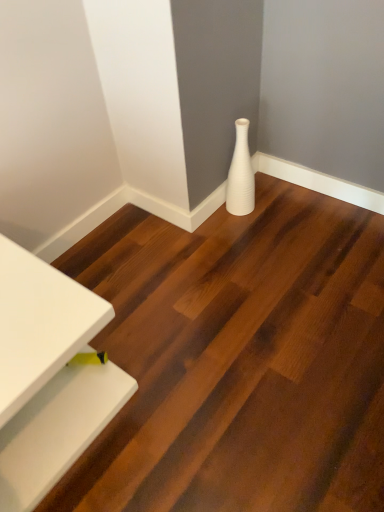
Question: From the image's perspective, would you say white ribbed vase at lower right is positioned over white glossy vase at center?

Choices:
 (A) no
 (B) yes

Answer: (B)

Question: Would you say white glossy vase at center is part of white ribbed vase at lower right's contents?

Choices:
 (A) yes
 (B) no

Answer: (B)

Question: Is white ribbed vase at lower right further to the viewer compared to white glossy vase at center?

Choices:
 (A) no
 (B) yes

Answer: (B)

Question: Does white ribbed vase at lower right appear on the right side of white glossy vase at center?

Choices:
 (A) yes
 (B) no

Answer: (A)

Question: Is white ribbed vase at lower right smaller than white glossy vase at center?

Choices:
 (A) yes
 (B) no

Answer: (A)

Question: Can you confirm if white ribbed vase at lower right is taller than white glossy vase at center?

Choices:
 (A) no
 (B) yes

Answer: (B)

Question: Can you confirm if white ribbed vase at lower right is smaller than white glossy table at lower left?

Choices:
 (A) yes
 (B) no

Answer: (A)

Question: Is white ribbed vase at lower right oriented towards white glossy table at lower left?

Choices:
 (A) yes
 (B) no

Answer: (A)

Question: From the image's perspective, would you say white ribbed vase at lower right is positioned over white glossy table at lower left?

Choices:
 (A) no
 (B) yes

Answer: (B)

Question: Does white ribbed vase at lower right have a larger size compared to white glossy table at lower left?

Choices:
 (A) yes
 (B) no

Answer: (B)

Question: Is white ribbed vase at lower right to the right of white glossy table at lower left from the viewer's perspective?

Choices:
 (A) no
 (B) yes

Answer: (B)

Question: Is white ribbed vase at lower right thinner than white glossy table at lower left?

Choices:
 (A) yes
 (B) no

Answer: (A)

Question: Is white glossy table at lower left far away from white glossy vase at center?

Choices:
 (A) no
 (B) yes

Answer: (A)